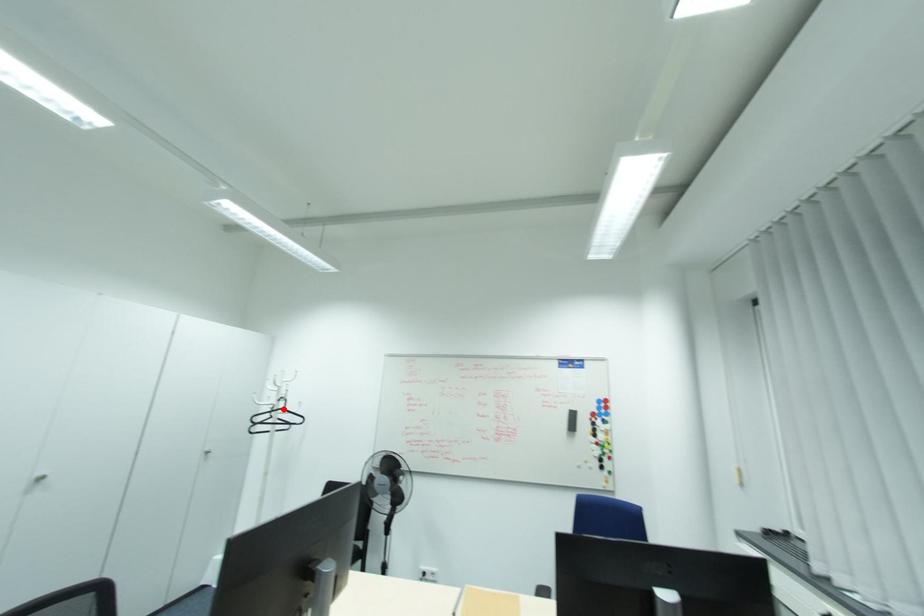
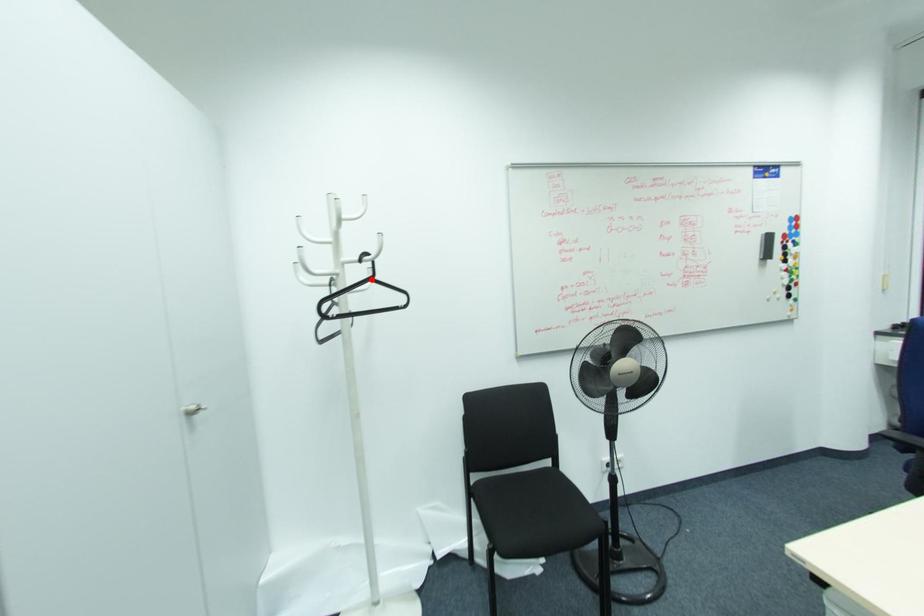
I am providing you with two images of the same scene from different viewpoints. A red point is marked on the first image and another point is marked on the second image. Is the marked point in image1 the same physical position as the marked point in image2?

Yes